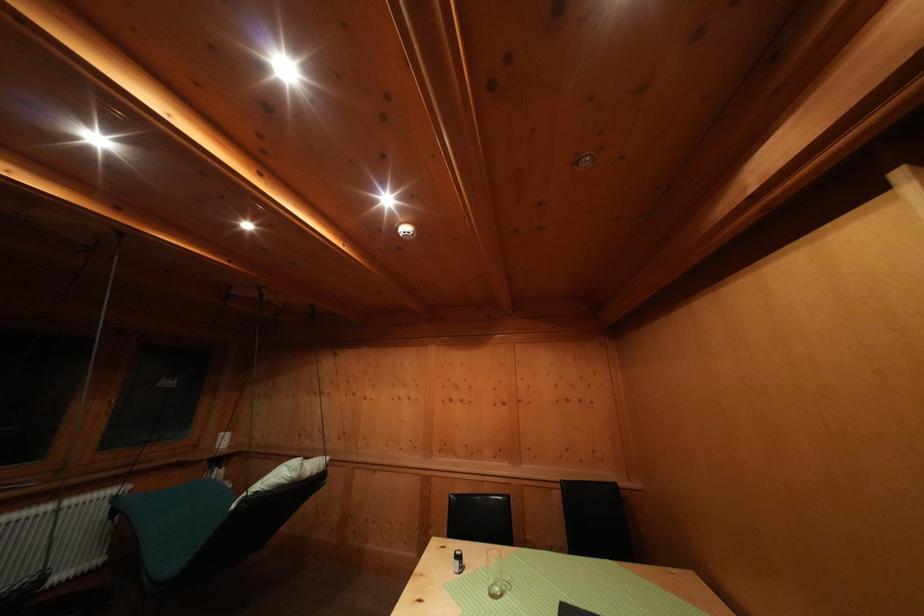
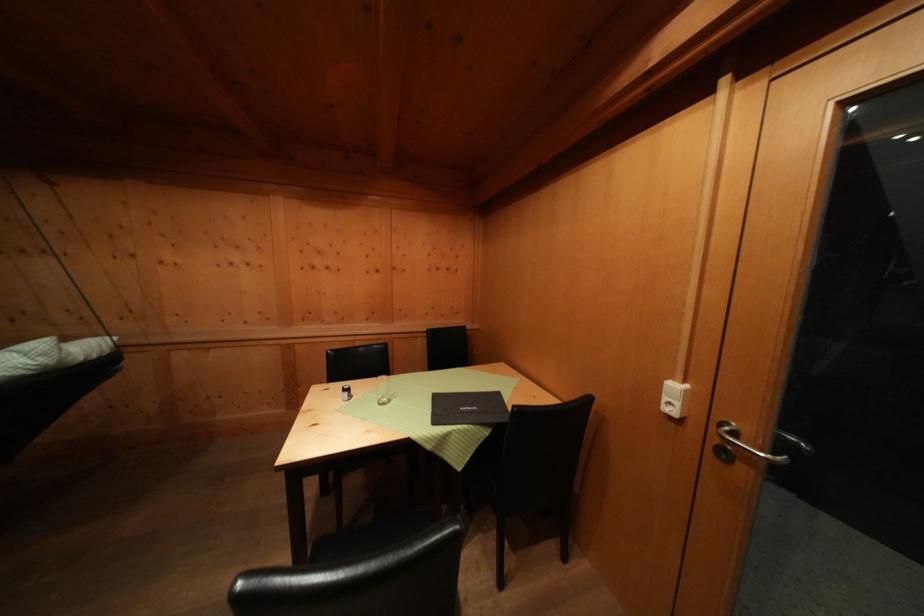
Based on the continuous images, in which direction is the camera rotating?

The camera rotated toward right-down.